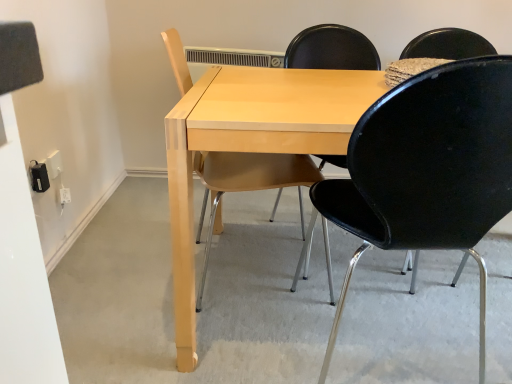
The image size is (512, 384). In order to click on vacant area situated to the left side of light wood chair at center, the 2th chair positioned from the right in this screenshot , I will do `click(124, 280)`.